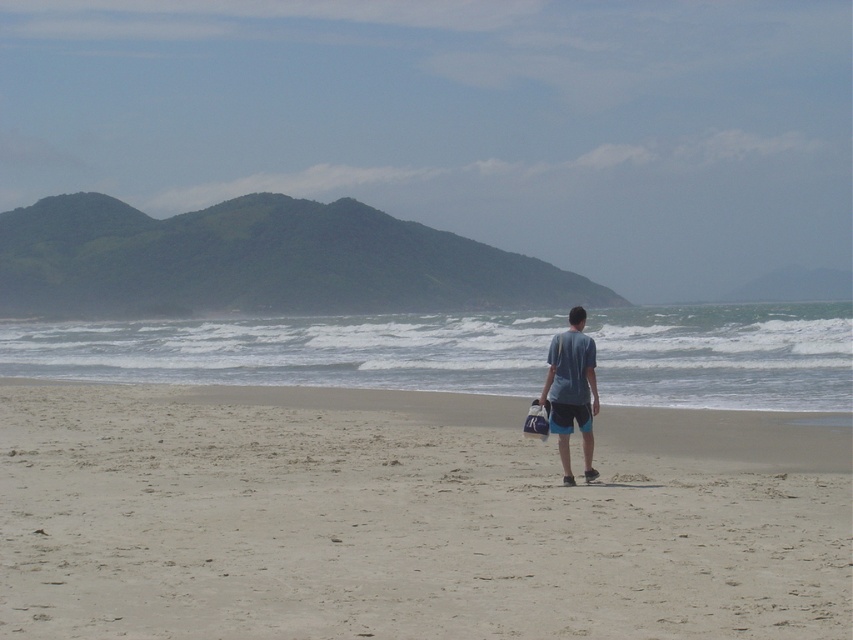
You are a photographer trying to capture the blue cotton shirt at center and the light beige sand at center in a single frame. Based on their positions, which object should you focus on first to ensure both are in the shot?

The light beige sand at center is to the left of the blue cotton shirt at center, so you should focus on the blue cotton shirt at center first as it is positioned further to the right, allowing the sand to naturally fall into the frame on its left side.

You are standing on the light beige sand at center and want to see the top of the blue cotton shirt at center. Will the sand block your view?

The light beige sand at center is not as tall as the blue cotton shirt at center, so the sand will not block your view of the top of the blue cotton shirt at center.

You are standing on the beach and want to place a 2.5 meter long wooden board between the light beige sand at center and the blue cotton shirt at center. Is there enough space to place it without bending the board?

The light beige sand at center and the blue cotton shirt at center are 5.70 meters apart, so yes, the 2.5 meter long wooden board can be placed between them since the distance is sufficient.